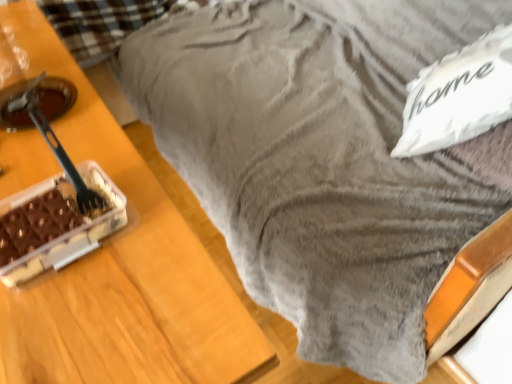
You are a GUI agent. You are given a task and a screenshot of the screen. Output one action in this format:
    pyautogui.click(x=<x>, y=<y>)
    Task: Click on the free space above chocolate matte cake at left (from a real-world perspective)
    This screenshot has height=384, width=512.
    Given the screenshot: What is the action you would take?
    pyautogui.click(x=49, y=212)